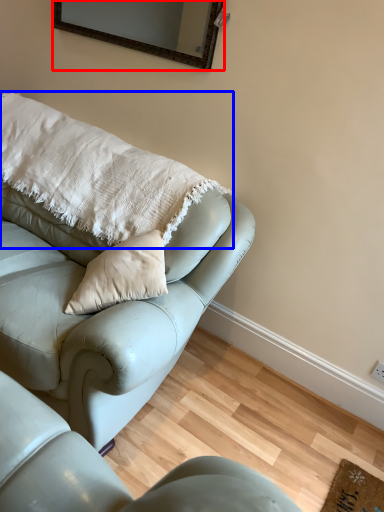
Question: Among these objects, which one is nearest to the camera, mirror (highlighted by a red box) or pillow (highlighted by a blue box)?

Choices:
 (A) mirror
 (B) pillow

Answer: (B)